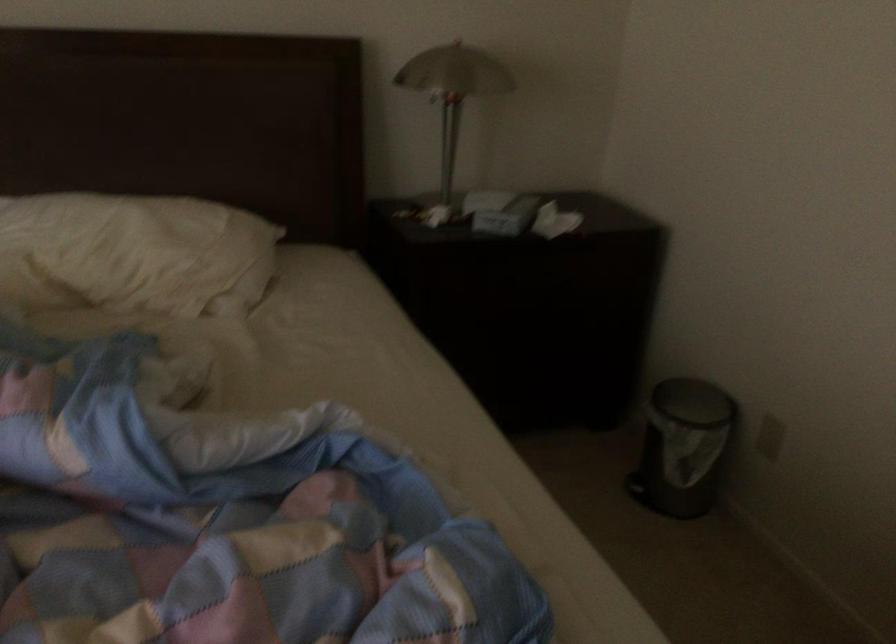
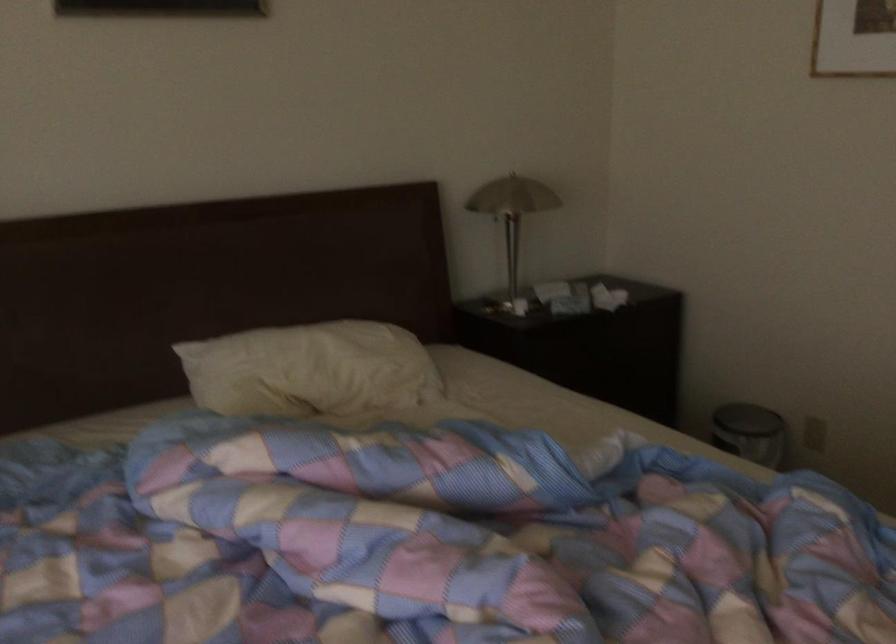
In a continuous first-person perspective shot, in which direction is the camera moving?

The movement direction of the cameraman is left, backward.